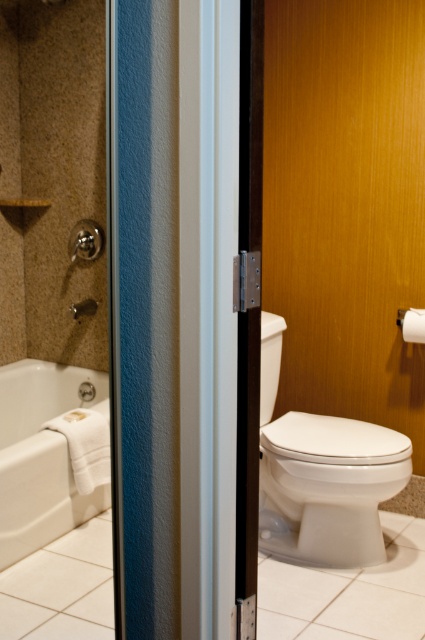
Question: Is white glossy toilet at right wider than matte silver shower at left?

Choices:
 (A) yes
 (B) no

Answer: (A)

Question: Is white glossy bathtub at lower left to the right of white matte toilet paper at right from the viewer's perspective?

Choices:
 (A) yes
 (B) no

Answer: (B)

Question: Which object appears closest to the camera in this image?

Choices:
 (A) white glossy bathtub at lower left
 (B) white matte toilet paper at right

Answer: (A)

Question: Which of the following is the closest to the observer?

Choices:
 (A) matte silver shower at left
 (B) white matte toilet paper at right

Answer: (B)

Question: Can you confirm if white glossy toilet at right is positioned below matte silver shower at left?

Choices:
 (A) no
 (B) yes

Answer: (B)

Question: Which object is positioned closest to the white matte toilet paper at right?

Choices:
 (A) white glossy bathtub at lower left
 (B) white glossy toilet at right
 (C) matte silver shower at left

Answer: (B)